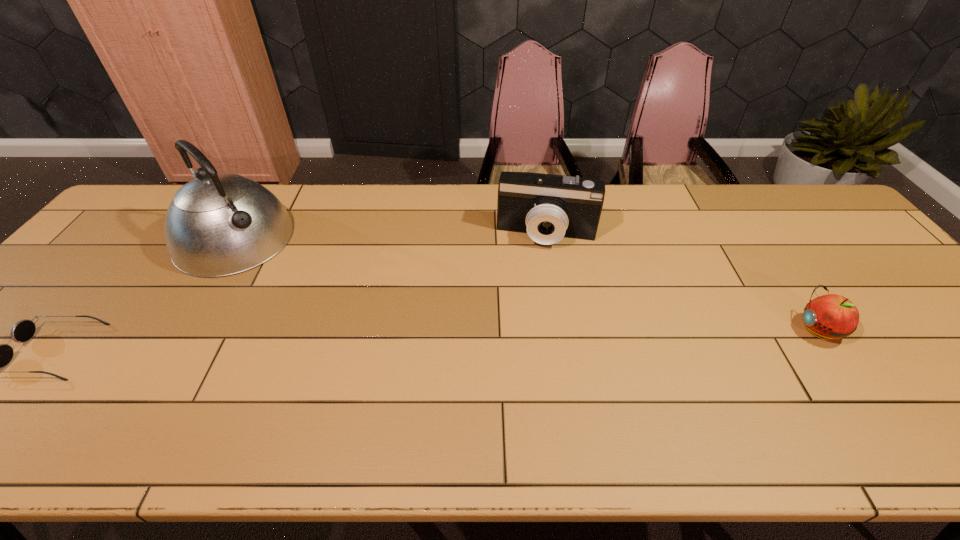
At what (x,y) coordinates should I click in order to perform the action: click on the third tallest object. Please return your answer as a coordinate pair (x, y). This screenshot has height=540, width=960. Looking at the image, I should click on pyautogui.click(x=831, y=316).

You are a GUI agent. You are given a task and a screenshot of the screen. Output one action in this format:
    pyautogui.click(x=<x>, y=<y>)
    Task: Click on the apple
    
    Given the screenshot: What is the action you would take?
    pyautogui.click(x=831, y=316)

Identify the location of the third shortest object. This screenshot has width=960, height=540. (547, 207).

Where is `camcorder`? The width and height of the screenshot is (960, 540). camcorder is located at coordinates (547, 207).

Identify the location of kettle. This screenshot has height=540, width=960. (219, 224).

Locate an element on the screen. The height and width of the screenshot is (540, 960). the tallest object is located at coordinates 219,224.

At what (x,y) coordinates should I click in order to perform the action: click on blank space located 0.280m on the surface of the apple. Please return your answer as a coordinate pair (x, y). Image resolution: width=960 pixels, height=540 pixels. Looking at the image, I should click on (682, 329).

Find the location of a particular element. Image resolution: width=960 pixels, height=540 pixels. vacant region located 0.290m on the surface of the apple is located at coordinates (677, 329).

You are a GUI agent. You are given a task and a screenshot of the screen. Output one action in this format:
    pyautogui.click(x=<x>, y=<y>)
    Task: Click on the vacant position located 0.080m on the surface of the apple
    The width and height of the screenshot is (960, 540).
    Given the screenshot: What is the action you would take?
    pyautogui.click(x=764, y=329)

Identify the location of free space located on the lens of the second tallest object. This screenshot has height=540, width=960. (530, 337).